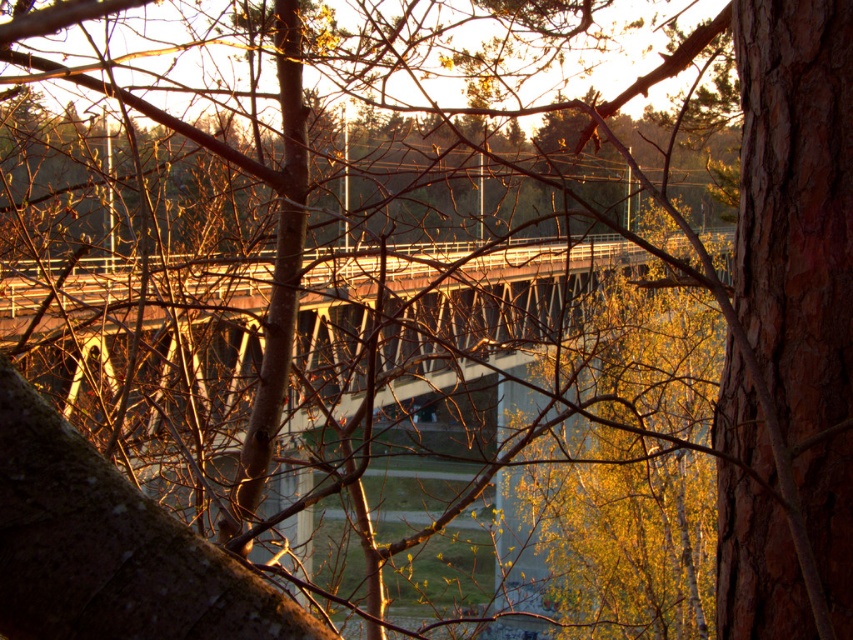
Question: Which of the following is the closest to the observer?

Choices:
 (A) (444, 356)
 (B) (811, 88)

Answer: (B)

Question: Is rusty metal bridge at center positioned behind brown rough bark at center right?

Choices:
 (A) yes
 (B) no

Answer: (A)

Question: Is rusty metal bridge at center positioned in front of brown rough bark at center right?

Choices:
 (A) yes
 (B) no

Answer: (B)

Question: Observing the image, what is the correct spatial positioning of rusty metal bridge at center in reference to brown rough bark at center right?

Choices:
 (A) above
 (B) below

Answer: (B)

Question: Which point is farther to the camera?

Choices:
 (A) rusty metal bridge at center
 (B) brown rough bark at center right

Answer: (A)